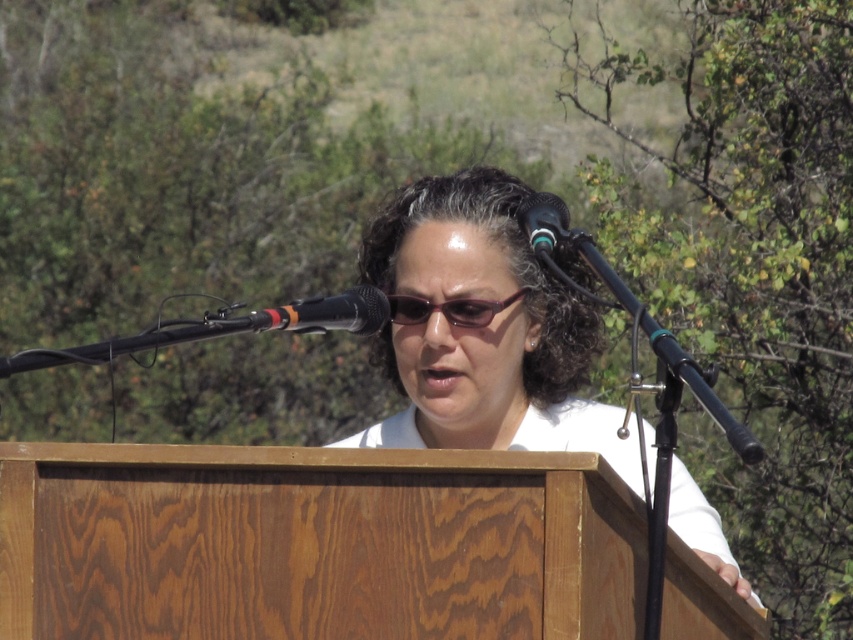
Who is positioned more to the right, black metallic microphone at center or black plastic microphone at upper center?

black plastic microphone at upper center

Who is more forward, (340,316) or (527,209)?

Point (340,316)

The height and width of the screenshot is (640, 853). What are the coordinates of `black metallic microphone at center` in the screenshot? It's located at (328, 314).

Between matte white shirt at center and purple shiny glasses at center, which one appears on the right side from the viewer's perspective?

Positioned to the right is matte white shirt at center.

Is matte white shirt at center taller than purple shiny glasses at center?

Correct, matte white shirt at center is much taller as purple shiny glasses at center.

This screenshot has height=640, width=853. I want to click on matte white shirt at center, so click(483, 330).

Can you confirm if matte white shirt at center is positioned to the right of black plastic microphone at upper center?

Indeed, matte white shirt at center is positioned on the right side of black plastic microphone at upper center.

Is point (526, 308) less distant than point (547, 216)?

No, it is not.

Is point (425, 385) positioned after point (534, 209)?

Yes, point (425, 385) is farther from viewer.

Find the location of `matte white shirt at center`. matte white shirt at center is located at coordinates (483, 330).